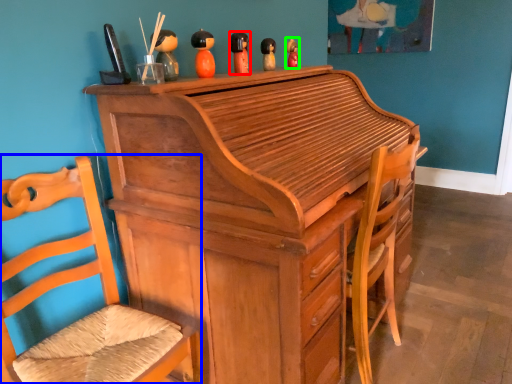
Question: Considering the real-world distances, which object is farthest from toy (highlighted by a red box)? chair (highlighted by a blue box) or toy (highlighted by a green box)?

Choices:
 (A) chair
 (B) toy

Answer: (A)